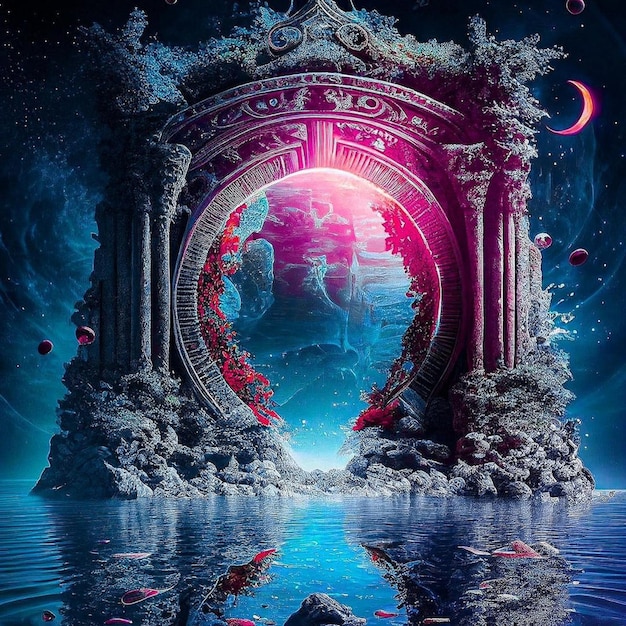
Locate an element on the screen. The image size is (626, 626). pink glow in archway is located at coordinates (337, 170).